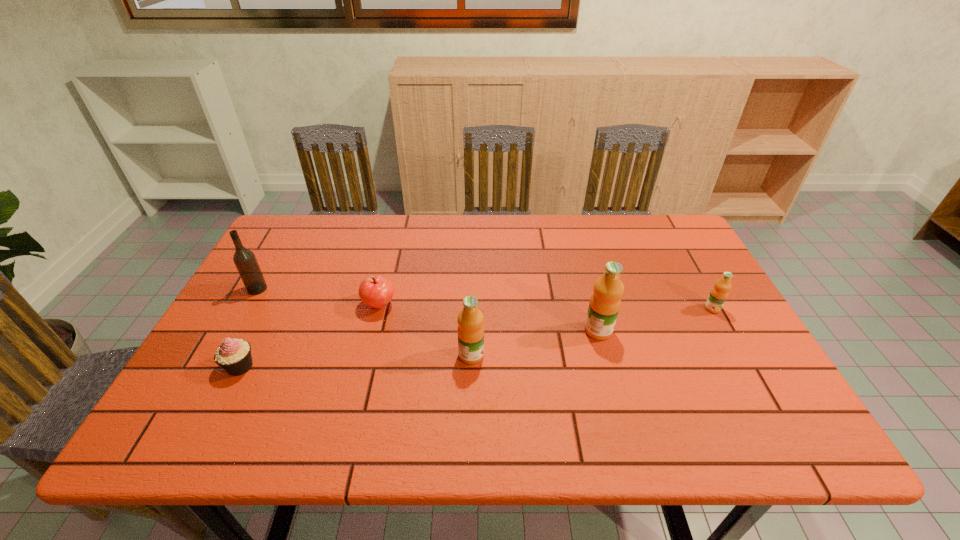
Image resolution: width=960 pixels, height=540 pixels. I want to click on free space located on the label of the third nearest object, so click(x=735, y=330).

At what (x,y) coordinates should I click in order to perform the action: click on vacant space located on the label of the shortest orange juice. Please return your answer as a coordinate pair (x, y). The height and width of the screenshot is (540, 960). Looking at the image, I should click on (733, 347).

This screenshot has height=540, width=960. What are the coordinates of `vacant point located 0.170m on the front of the vodka` in the screenshot? It's located at (228, 343).

This screenshot has width=960, height=540. I want to click on free space located on the right of the cupcake, so click(339, 367).

The width and height of the screenshot is (960, 540). What are the coordinates of `free space located on the right of the apple` in the screenshot? It's located at (542, 305).

This screenshot has height=540, width=960. Identify the location of object that is positioned at the near edge. (234, 355).

Find the location of a particular element. vodka that is at the left edge is located at coordinates (244, 259).

Locate an element on the screen. Image resolution: width=960 pixels, height=540 pixels. cupcake present at the left edge is located at coordinates click(x=234, y=355).

The width and height of the screenshot is (960, 540). I want to click on object that is at the right edge, so (x=719, y=293).

At what (x,y) coordinates should I click in order to perform the action: click on object located at the near left corner. Please return your answer as a coordinate pair (x, y). Looking at the image, I should click on point(234,355).